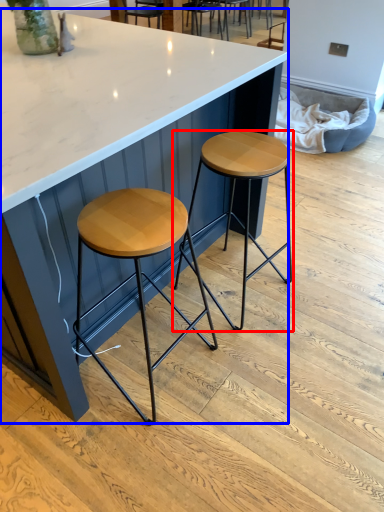
Question: Which point is further to the camera, stool (highlighted by a red box) or table (highlighted by a blue box)?

Choices:
 (A) stool
 (B) table

Answer: (A)